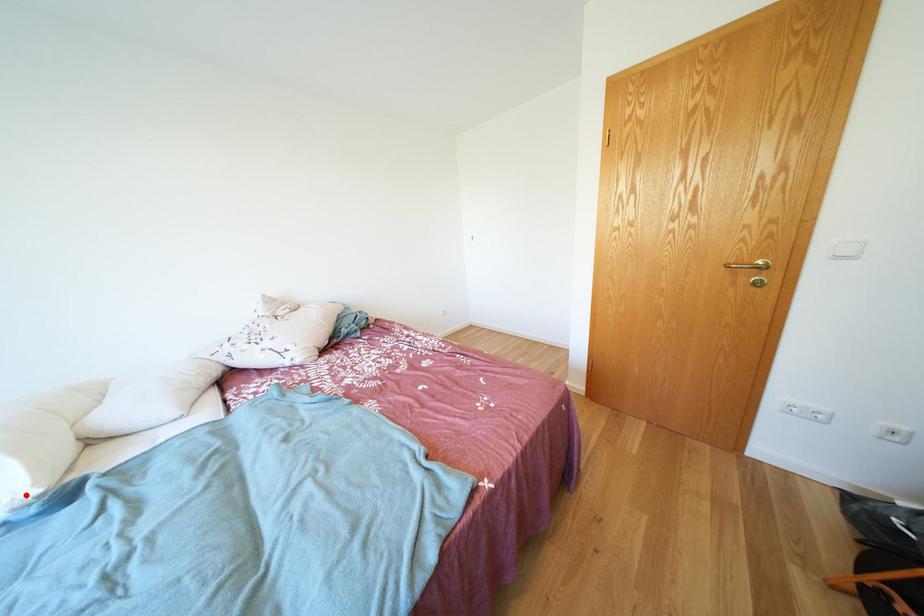
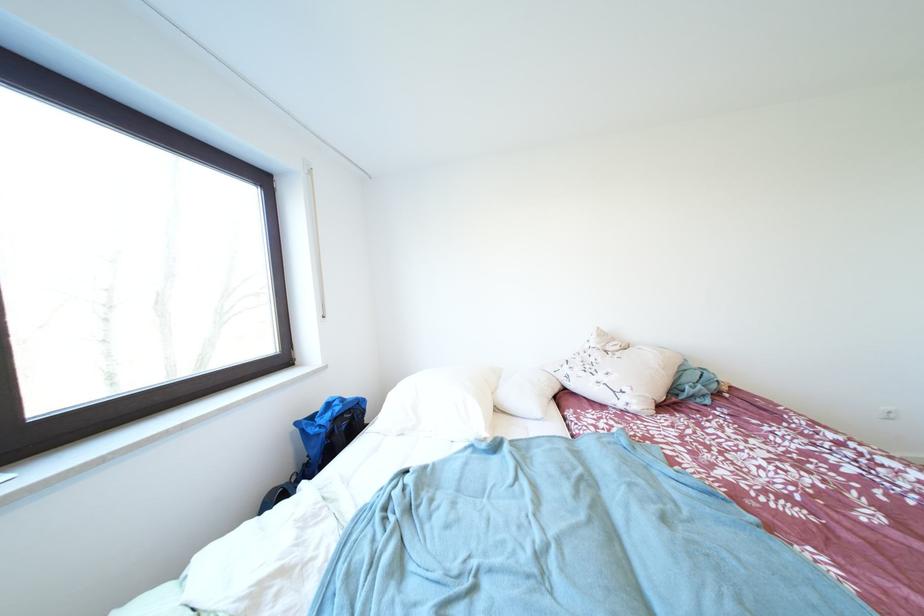
Where in the second image is the point corresponding to the highlighted location from the first image?

(488, 432)